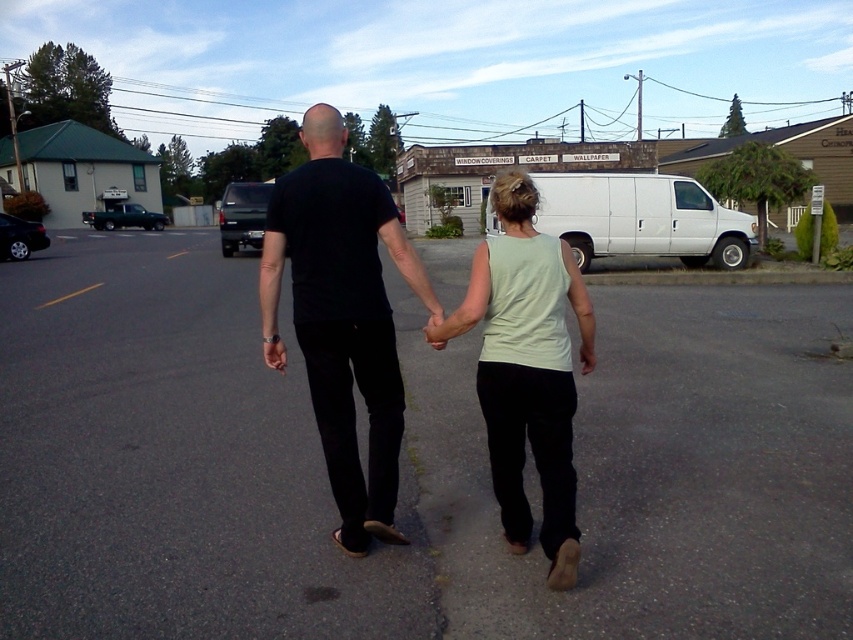
You are standing at the point marked by the coordinates point (x=341, y=317). Looking around, you see a black matte shirt at center and other objects in the scene. What object is directly beneath you?

The point (x=341, y=317) is on the black matte shirt at center, so the object directly beneath you is the black matte shirt at center.

You are a photographer trying to capture the two people holding hands. You want to ensure that both the light green sleeveless top at center and the matte black hand at center are clearly visible in the photo. Which object should you focus on to ensure proper exposure, considering their sizes?

The light green sleeveless top at center is wider than the matte black hand at center, so focusing on the larger object, the light green sleeveless top at center, would ensure both are properly exposed.

Consider the image. You are a photographer trying to capture a clear photo of the black matte shirt at center and the matte black hand at center. Since both are black, you need to adjust your camera settings to ensure proper exposure. Which object should you adjust the exposure for first to ensure it doesn?t get overexposed?

The black matte shirt at center has a larger size compared to matte black hand at center, so you should adjust the exposure for the black matte shirt at center first to prevent overexposure due to its larger surface area.